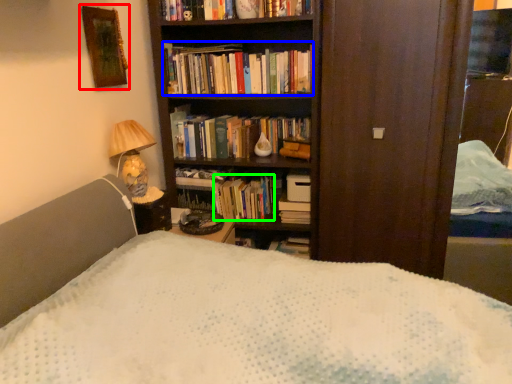
Question: Estimate the real-world distances between objects in this image. Which object is farther from picture frame (highlighted by a red box), book (highlighted by a blue box) or book (highlighted by a green box)?

Choices:
 (A) book
 (B) book

Answer: (B)